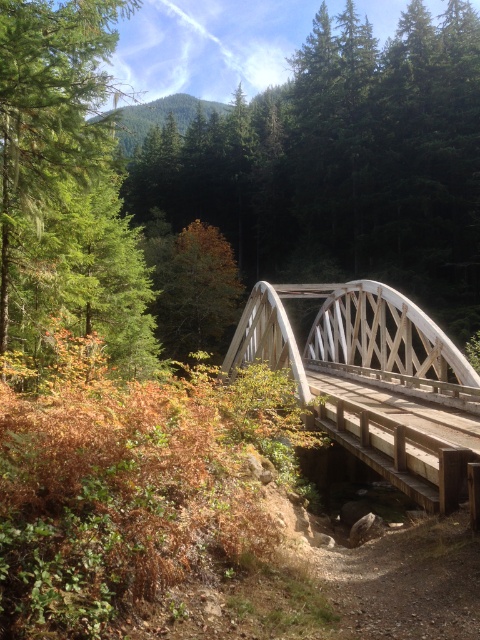
Question: Is the position of green matte tree at upper left less distant than that of orange matte tree at center?

Choices:
 (A) yes
 (B) no

Answer: (A)

Question: Among these points, which one is farthest from the camera?

Choices:
 (A) (85, 83)
 (B) (439, 448)
 (C) (214, 337)

Answer: (C)

Question: Among these points, which one is farthest from the camera?

Choices:
 (A) (22, 51)
 (B) (182, 292)

Answer: (B)

Question: Is green matte tree at upper left below orange matte tree at center?

Choices:
 (A) yes
 (B) no

Answer: (A)

Question: Among these objects, which one is nearest to the camera?

Choices:
 (A) white wooden bridge at center
 (B) orange matte tree at center
 (C) green matte tree at upper left

Answer: (A)

Question: Does green matte tree at upper left come behind orange matte tree at center?

Choices:
 (A) yes
 (B) no

Answer: (B)